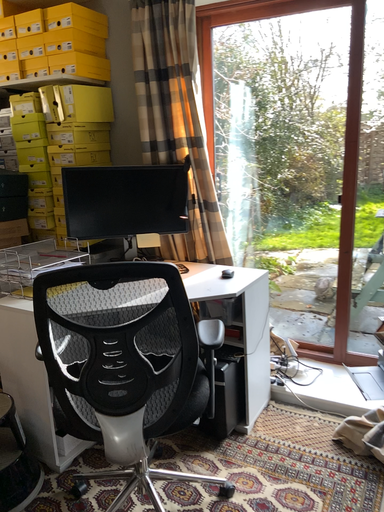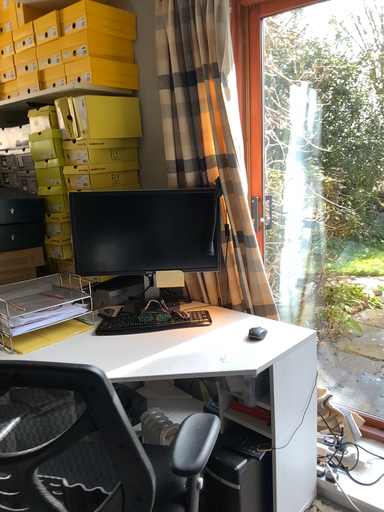
Question: How did the camera likely rotate when shooting the video?

Choices:
 (A) rotated right
 (B) rotated left

Answer: (B)